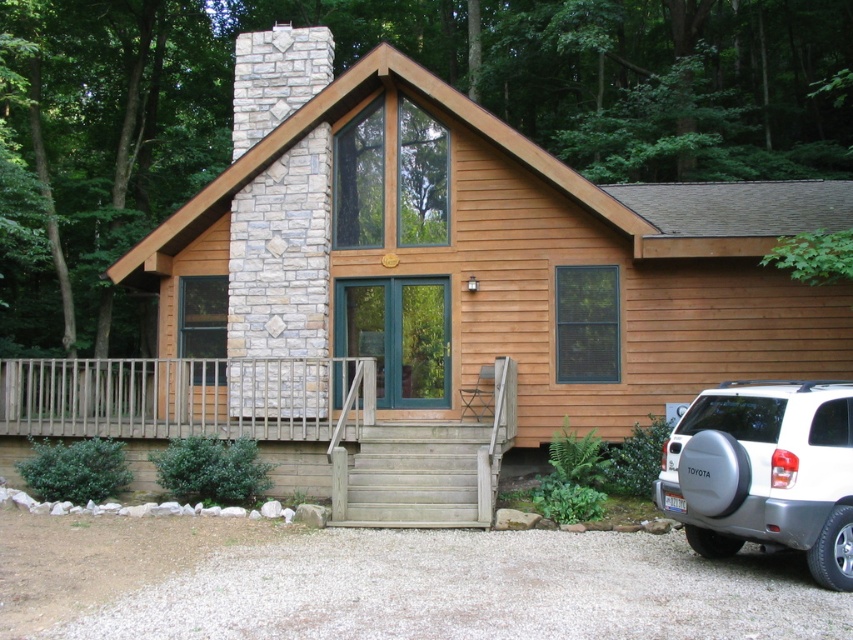
You are a delivery person carrying a package that requires a flat surface to place temporarily. You see the wooden porch at center and the wooden stairs at center. Which location has enough space to place the package without it being on the stairs?

The wooden porch at center has enough space to place the package since it is 16.84 feet away from the wooden stairs at center, providing sufficient distance for placement.

You are a delivery person approaching the house and need to unload a package from your silver metallic suv at lower right. To reach the wooden porch at center, do you need to climb any stairs?

The wooden porch at center is above the silver metallic suv at lower right, so yes, you will need to climb the wooden steps leading up to the wooden porch at center to reach it from the silver metallic suv at lower right.

You are standing at the camera position looking at the rustic house. There is a point marked at coordinates point (30,387). Can you estimate how far this point is from your current position?

The point (30,387) is 12.46 meters away from the camera, so the distance is approximately 12.46 meters.